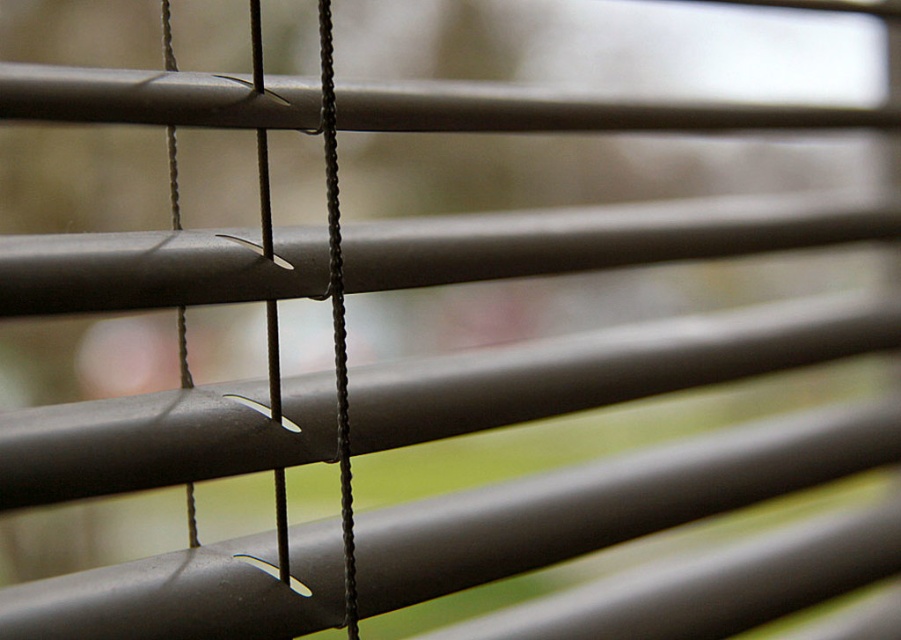
Can you confirm if black cord at center is positioned above black matte string at center?

Incorrect, black cord at center is not positioned above black matte string at center.

Where is `black cord at center`? The image size is (901, 640). black cord at center is located at coordinates (337, 310).

Does black matte string at center have a greater width compared to black matte string at left?

Correct, the width of black matte string at center exceeds that of black matte string at left.

Who is shorter, black matte string at center or black matte string at left?

Standing shorter between the two is black matte string at left.

Find the location of a particular element. Image resolution: width=901 pixels, height=640 pixels. black matte string at center is located at coordinates (264, 195).

Looking at this image, does black cord at center have a smaller size compared to black matte string at left?

Actually, black cord at center might be larger than black matte string at left.

Between point (340, 296) and point (170, 29), which one is positioned behind?

The point (340, 296) is behind.

What do you see at coordinates (337, 310) in the screenshot?
I see `black cord at center` at bounding box center [337, 310].

I want to click on black cord at center, so coord(337,310).